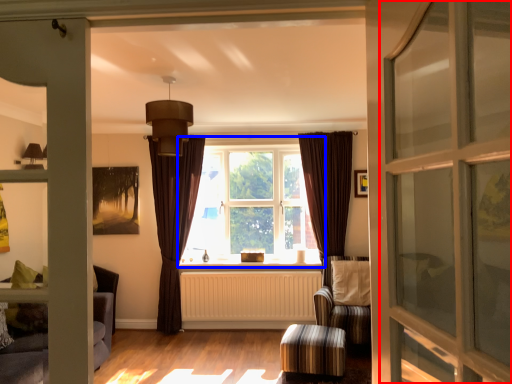
Question: Which object is further to the camera taking this photo, screen door (highlighted by a red box) or window (highlighted by a blue box)?

Choices:
 (A) screen door
 (B) window

Answer: (B)